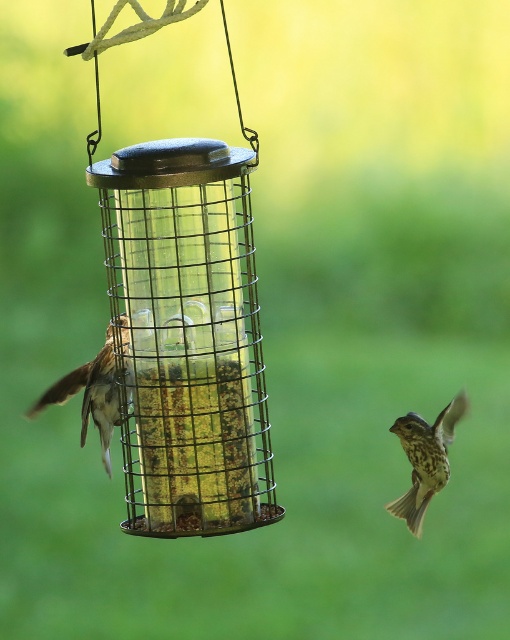
Question: Which object is positioned farthest from the brown speckled feathers at left?

Choices:
 (A) metallic wire mesh bird feeder at left
 (B) brown speckled sparrow at lower right

Answer: (B)

Question: From the image, what is the correct spatial relationship of metallic wire mesh bird feeder at left in relation to brown speckled sparrow at lower right?

Choices:
 (A) right
 (B) left

Answer: (B)

Question: Which object is farther from the camera taking this photo?

Choices:
 (A) brown speckled sparrow at lower right
 (B) brown speckled feathers at left

Answer: (A)

Question: Can you confirm if metallic wire mesh bird feeder at left is thinner than brown speckled feathers at left?

Choices:
 (A) yes
 (B) no

Answer: (B)

Question: Which point appears farthest from the camera in this image?

Choices:
 (A) (93, 388)
 (B) (403, 435)

Answer: (B)

Question: Does metallic wire mesh bird feeder at left appear under brown speckled feathers at left?

Choices:
 (A) yes
 (B) no

Answer: (B)